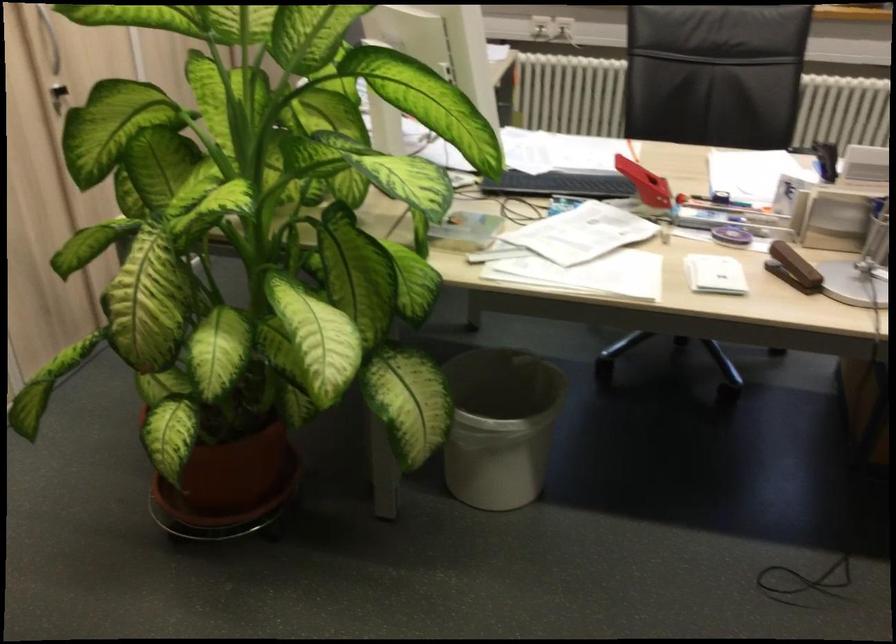
Where would you lift the white trash can? Please return your answer as a coordinate pair (x, y).

(500, 426)